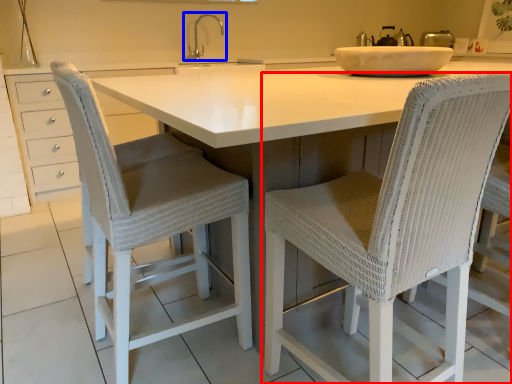
Question: Which of the following is the farthest to the observer, chair (highlighted by a red box) or tap (highlighted by a blue box)?

Choices:
 (A) chair
 (B) tap

Answer: (B)